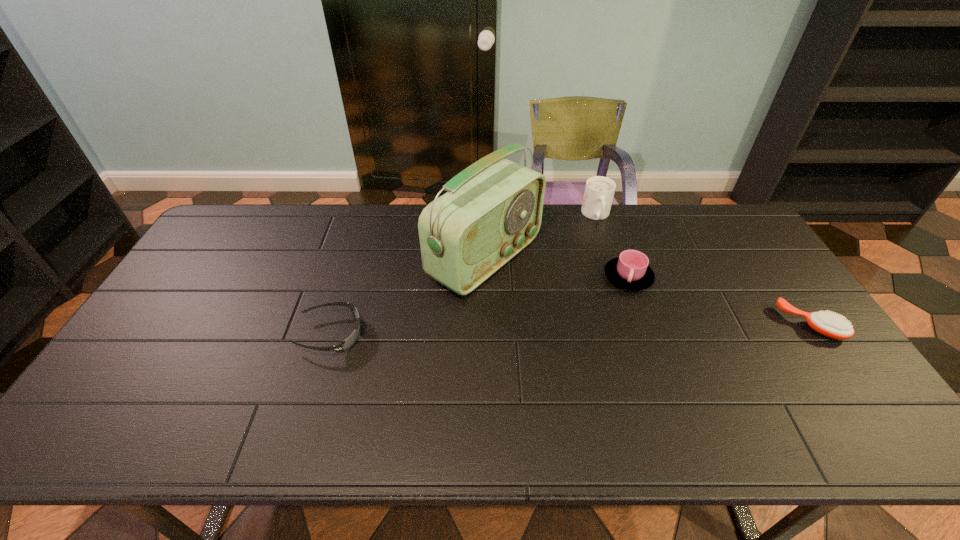
The width and height of the screenshot is (960, 540). Identify the location of empty location between the cup and the rightmost object. (719, 301).

You are a GUI agent. You are given a task and a screenshot of the screen. Output one action in this format:
    pyautogui.click(x=<x>, y=<y>)
    Task: Click on the vacant area that lies between the rightmost object and the radio receiver
    This screenshot has height=540, width=960.
    Given the screenshot: What is the action you would take?
    pyautogui.click(x=648, y=291)

The width and height of the screenshot is (960, 540). Find the location of `vacant space in between the tallest object and the rightmost object`. vacant space in between the tallest object and the rightmost object is located at coordinates (648, 291).

The width and height of the screenshot is (960, 540). I want to click on blank region between the leftmost object and the third shortest object, so click(x=479, y=306).

Locate which object is the second closest to the hairbrush. Please provide its 2D coordinates. Your answer should be formatted as a tuple, i.e. [(x, y)], where the tuple contains the x and y coordinates of a point satisfying the conditions above.

[(599, 191)]

Select which object appears as the second closest to the cappuccino. Please provide its 2D coordinates. Your answer should be formatted as a tuple, i.e. [(x, y)], where the tuple contains the x and y coordinates of a point satisfying the conditions above.

[(630, 271)]

This screenshot has height=540, width=960. I want to click on free point that satisfies the following two spatial constraints: 1. on the front side of the third shortest object; 2. on the right side of the rightmost object, so click(x=644, y=324).